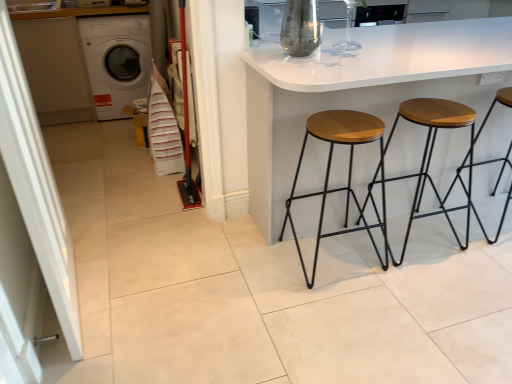
Question: From the image's perspective, would you say white striped fabric at left is shown under wooden/metallic stool at center, marked as the second stool in a right-to-left arrangement?

Choices:
 (A) no
 (B) yes

Answer: (A)

Question: Is white striped fabric at left not close to wooden/metallic stool at center, marked as the second stool in a right-to-left arrangement?

Choices:
 (A) yes
 (B) no

Answer: (A)

Question: Is white striped fabric at left touching wooden/metallic stool at center, which is counted as the second stool, starting from the left?

Choices:
 (A) yes
 (B) no

Answer: (B)

Question: Can you confirm if white striped fabric at left is wider than wooden/metallic stool at center, marked as the second stool in a right-to-left arrangement?

Choices:
 (A) no
 (B) yes

Answer: (A)

Question: Considering the relative positions of white striped fabric at left and wooden/metallic stool at center, marked as the second stool in a right-to-left arrangement, in the image provided, is white striped fabric at left to the left of wooden/metallic stool at center, marked as the second stool in a right-to-left arrangement, from the viewer's perspective?

Choices:
 (A) no
 (B) yes

Answer: (B)

Question: Considering the relative positions of white glossy washing machine at left and wooden/metallic stool at center, which is counted as the second stool, starting from the left, in the image provided, is white glossy washing machine at left to the left or to the right of wooden/metallic stool at center, which is counted as the second stool, starting from the left,?

Choices:
 (A) left
 (B) right

Answer: (A)

Question: Is white glossy washing machine at left bigger or smaller than wooden/metallic stool at center, which is counted as the second stool, starting from the left?

Choices:
 (A) big
 (B) small

Answer: (A)

Question: Considering the positions of white glossy washing machine at left and wooden/metallic stool at center, marked as the second stool in a right-to-left arrangement, in the image, is white glossy washing machine at left wider or thinner than wooden/metallic stool at center, marked as the second stool in a right-to-left arrangement,?

Choices:
 (A) thin
 (B) wide

Answer: (B)

Question: Is white glossy washing machine at left spatially inside wooden/metallic stool at center, marked as the second stool in a right-to-left arrangement, or outside of it?

Choices:
 (A) outside
 (B) inside

Answer: (A)

Question: Looking at their shapes, would you say woodenmaterial/texturestool at center, marked as the 3th stool in a right-to-left arrangement, is wider or thinner than white striped fabric at left?

Choices:
 (A) thin
 (B) wide

Answer: (B)

Question: In terms of height, does woodenmaterial/texturestool at center, marked as the 3th stool in a right-to-left arrangement, look taller or shorter compared to white striped fabric at left?

Choices:
 (A) tall
 (B) short

Answer: (A)

Question: Is point (353, 195) positioned closer to the camera than point (159, 125)?

Choices:
 (A) farther
 (B) closer

Answer: (B)

Question: Is woodenmaterial/texturestool at center, the 1th stool from the left, in front of or behind white striped fabric at left in the image?

Choices:
 (A) front
 (B) behind

Answer: (A)

Question: Considering the relative positions of wooden barstools at center and wooden seat at right, the 3th stool in the left-to-right sequence, in the image provided, is wooden barstools at center to the left or to the right of wooden seat at right, the 3th stool in the left-to-right sequence,?

Choices:
 (A) right
 (B) left

Answer: (A)

Question: In terms of height, does wooden barstools at center look taller or shorter compared to wooden seat at right, positioned as the first stool in right-to-left order?

Choices:
 (A) short
 (B) tall

Answer: (B)